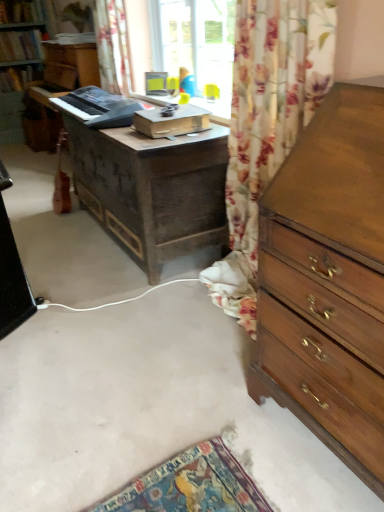
Image resolution: width=384 pixels, height=512 pixels. Identify the location of free location to the left of wooden chest of drawers at right. (203, 413).